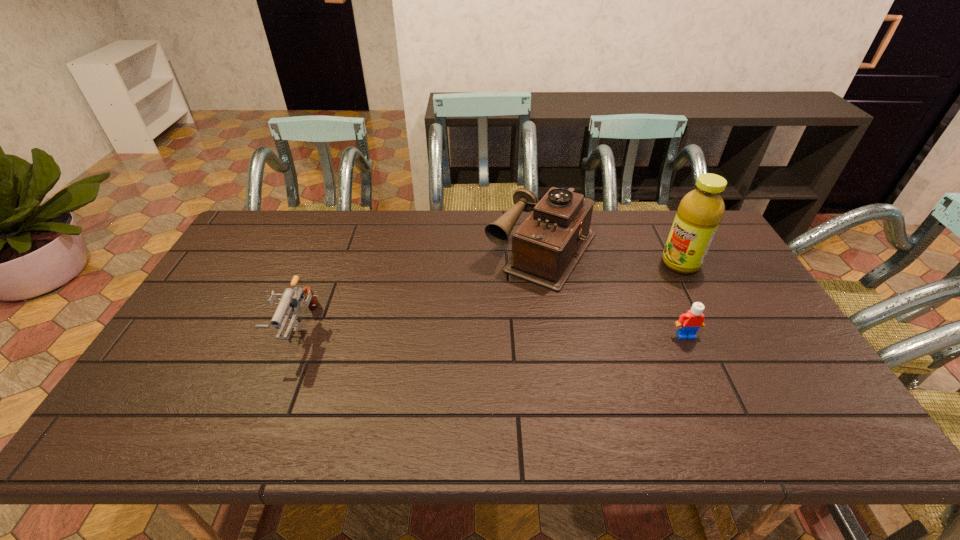
Find the location of `gun`. gun is located at coordinates (290, 299).

Where is `the third tallest object`? The height and width of the screenshot is (540, 960). the third tallest object is located at coordinates (290, 299).

This screenshot has width=960, height=540. Find the location of `Lego`. Lego is located at coordinates (689, 323).

In order to click on the third shortest object in this screenshot , I will do `click(547, 246)`.

You are a GUI agent. You are given a task and a screenshot of the screen. Output one action in this format:
    pyautogui.click(x=<x>, y=<y>)
    Task: Click on the phonograph_record
    
    Given the screenshot: What is the action you would take?
    pyautogui.click(x=547, y=246)

Where is `the tallest object`? This screenshot has height=540, width=960. the tallest object is located at coordinates (700, 211).

Identify the location of free space located 0.090m at the barrel end of the leftmost object. (273, 393).

Image resolution: width=960 pixels, height=540 pixels. I want to click on free space located 0.190m on the face of the shortest object, so click(x=715, y=402).

Locate an element on the screen. Image resolution: width=960 pixels, height=540 pixels. vacant space located on the horn of the third shortest object is located at coordinates (448, 379).

Identify the location of free space located on the horn of the third shortest object. The image size is (960, 540). (462, 361).